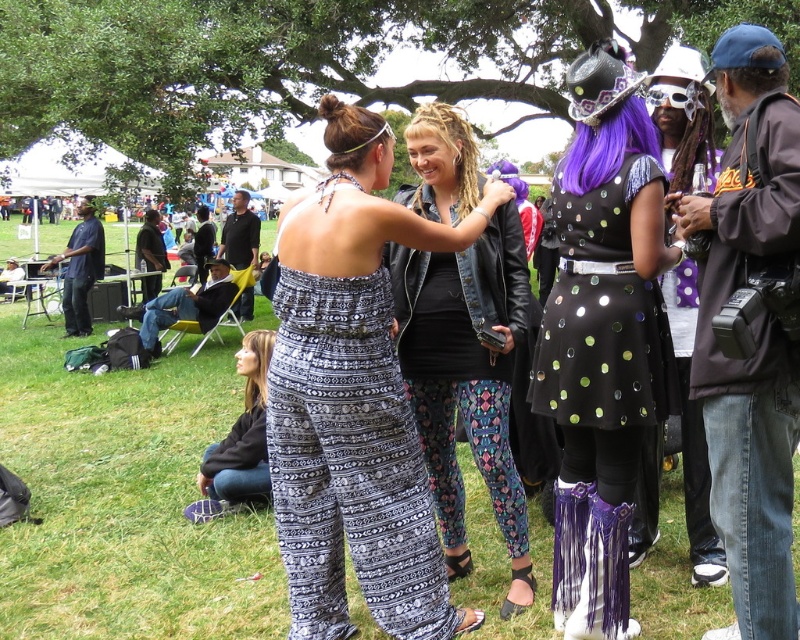
Question: Is green grass at center below shiny sequined dress at center?

Choices:
 (A) yes
 (B) no

Answer: (A)

Question: Is the position of patterned fabric jumpsuit at center more distant than that of shiny sequined dress at center?

Choices:
 (A) yes
 (B) no

Answer: (B)

Question: Among these objects, which one is nearest to the camera?

Choices:
 (A) green grass at center
 (B) sparkly black dress at center
 (C) patterned fabric jumpsuit at center
 (D) printed fabric pants at center

Answer: (C)

Question: Can you confirm if green grass at center is wider than sparkly black dress at center?

Choices:
 (A) no
 (B) yes

Answer: (B)

Question: Which object is farther from the camera taking this photo?

Choices:
 (A) shiny sequined dress at center
 (B) green grass at center
 (C) sparkly black dress at center

Answer: (B)

Question: Which point is closer to the camera?

Choices:
 (A) shiny sequined dress at center
 (B) sparkly black dress at center

Answer: (A)